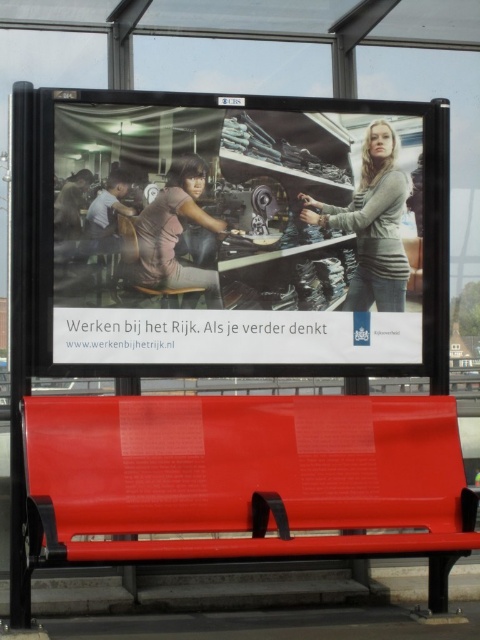
Does metallic red bench at center have a lesser height compared to gray sweater at center?

In fact, metallic red bench at center may be taller than gray sweater at center.

Which is in front, point (350, 499) or point (396, 250)?

Point (350, 499) is in front.

Is point (360, 499) more distant than point (357, 218)?

No, it is not.

Locate an element on the screen. The height and width of the screenshot is (640, 480). metallic red bench at center is located at coordinates (243, 481).

Can you confirm if gray sweater at center is shorter than pink fabric shirt at center?

No, gray sweater at center is not shorter than pink fabric shirt at center.

Who is more forward, [392,237] or [165,280]?

Point [165,280] is more forward.

The image size is (480, 640). What are the coordinates of `gray sweater at center` in the screenshot? It's located at (372, 224).

Between point (304, 220) and point (96, 234), which one is positioned in front?

Point (96, 234) is more forward.

Is point (367, 257) farther from viewer compared to point (107, 252)?

Yes, point (367, 257) is farther from viewer.

Identify the location of gray sweater at center. The height and width of the screenshot is (640, 480). (372, 224).